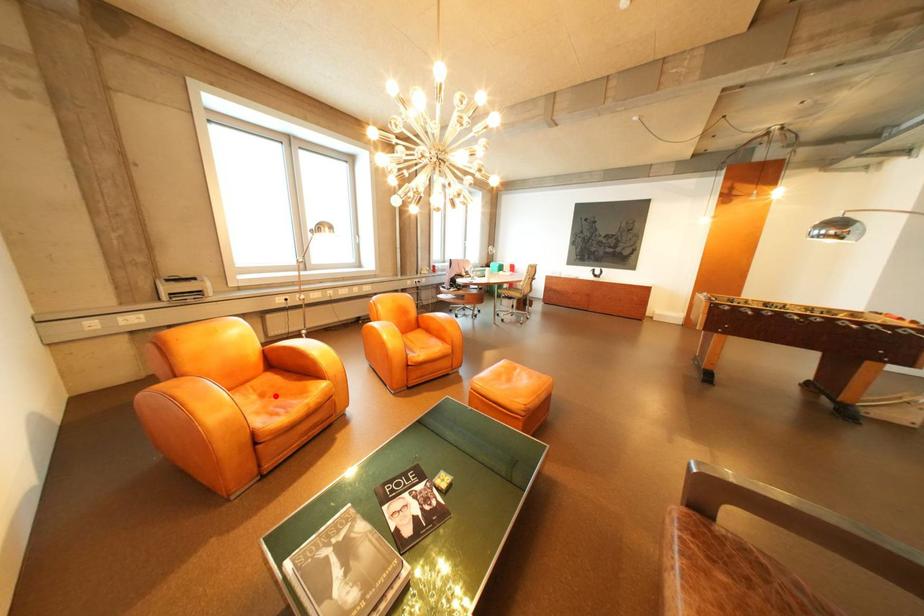
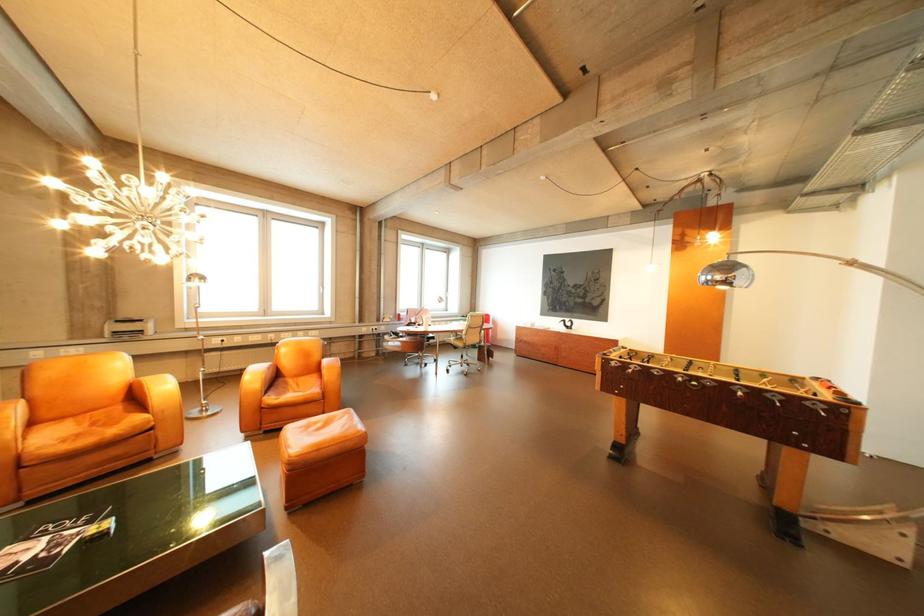
In the second image, find the point that corresponds to the highlighted location in the first image.

(107, 424)